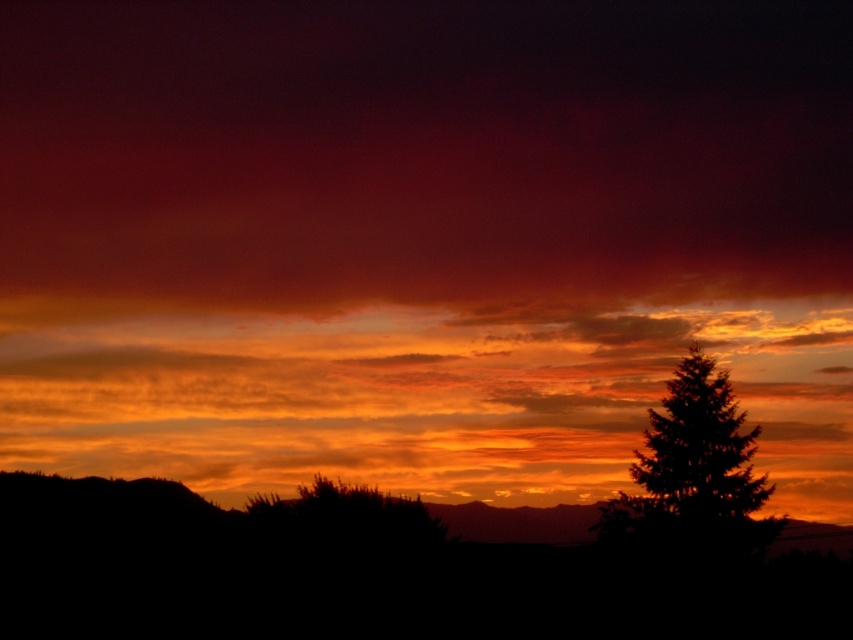
Question: Which of the following is the farthest from the observer?

Choices:
 (A) orange translucent clouds at center
 (B) green textured tree at right

Answer: (A)

Question: Is orange translucent clouds at center above green textured tree at right?

Choices:
 (A) no
 (B) yes

Answer: (A)

Question: Does orange translucent clouds at center appear on the left side of green textured tree at right?

Choices:
 (A) no
 (B) yes

Answer: (B)

Question: Can you confirm if orange translucent clouds at center is positioned below green textured tree at right?

Choices:
 (A) yes
 (B) no

Answer: (A)

Question: Which object is farther from the camera taking this photo?

Choices:
 (A) orange translucent clouds at center
 (B) green textured tree at right

Answer: (A)